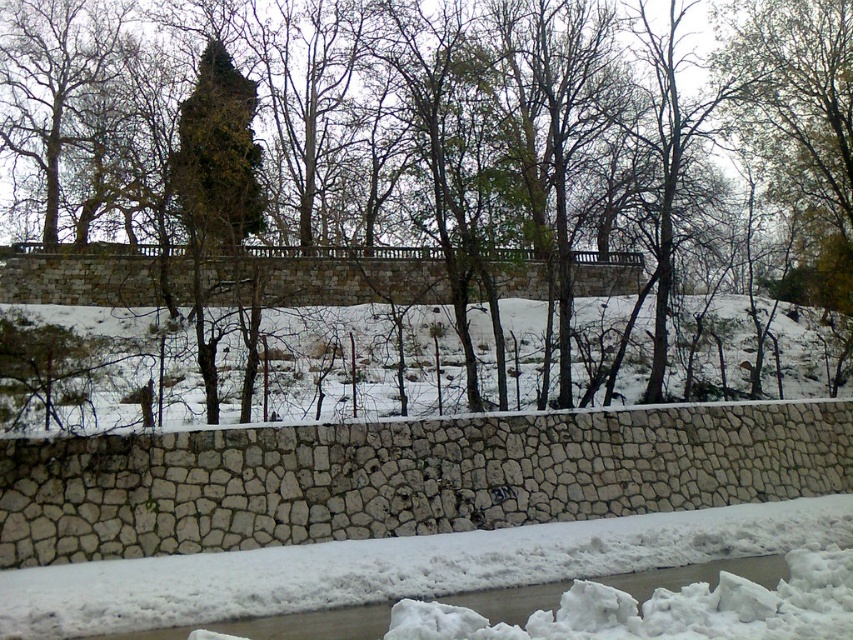
Question: Observing the image, what is the correct spatial positioning of green leafy tree at upper center in reference to green mossy tree at upper center?

Choices:
 (A) above
 (B) below

Answer: (B)

Question: Which object is closer to the camera taking this photo?

Choices:
 (A) green mossy tree at upper center
 (B) green leafy tree at upper center
 (C) white fluffy snow at lower center

Answer: (C)

Question: Estimate the real-world distances between objects in this image. Which object is closer to the green mossy tree at upper center?

Choices:
 (A) white fluffy snow at lower center
 (B) green leafy tree at upper center

Answer: (B)

Question: Which object appears farthest from the camera in this image?

Choices:
 (A) white fluffy snow at lower center
 (B) green mossy tree at upper center
 (C) green leafy tree at upper center

Answer: (B)

Question: Is the position of white fluffy snow at lower center more distant than that of green mossy tree at upper center?

Choices:
 (A) yes
 (B) no

Answer: (B)

Question: Does white fluffy snow at lower center have a larger size compared to green mossy tree at upper center?

Choices:
 (A) no
 (B) yes

Answer: (A)